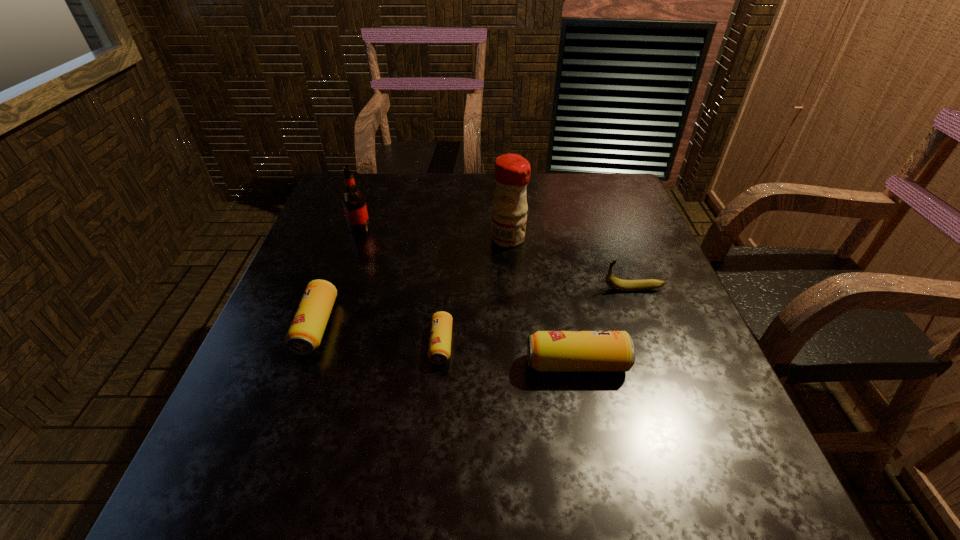
Locate an element on the screen. This screenshot has width=960, height=540. the leftmost beer can is located at coordinates (305, 333).

The width and height of the screenshot is (960, 540). I want to click on the second shortest beer can, so click(x=305, y=333).

The height and width of the screenshot is (540, 960). I want to click on the shortest beer can, so click(439, 350).

Where is `the shortest object`? Image resolution: width=960 pixels, height=540 pixels. the shortest object is located at coordinates (439, 350).

Where is `the rightmost beer can`? the rightmost beer can is located at coordinates (548, 351).

This screenshot has width=960, height=540. Identify the location of the fifth shortest object. (354, 204).

This screenshot has height=540, width=960. What are the coordinates of `banana` in the screenshot? It's located at (624, 285).

Where is `the tallest object`? the tallest object is located at coordinates (512, 172).

You are a GUI agent. You are given a task and a screenshot of the screen. Output one action in this format:
    pyautogui.click(x=<x>, y=<y>)
    Task: Click on the vacant region located on the back of the leftmost beer can
    
    Given the screenshot: What is the action you would take?
    pyautogui.click(x=333, y=281)

The image size is (960, 540). I want to click on vacant point located on the left of the shortest beer can, so click(x=406, y=344).